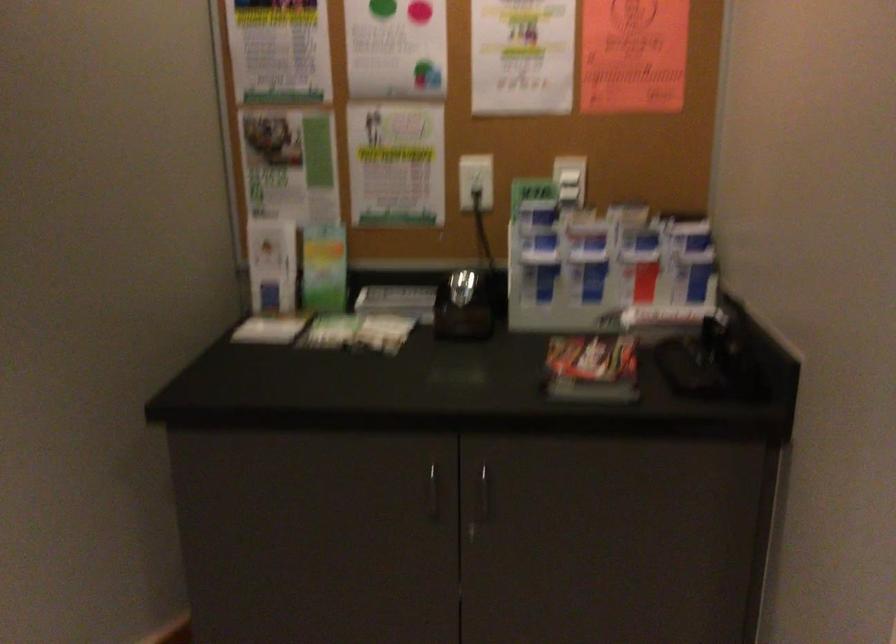
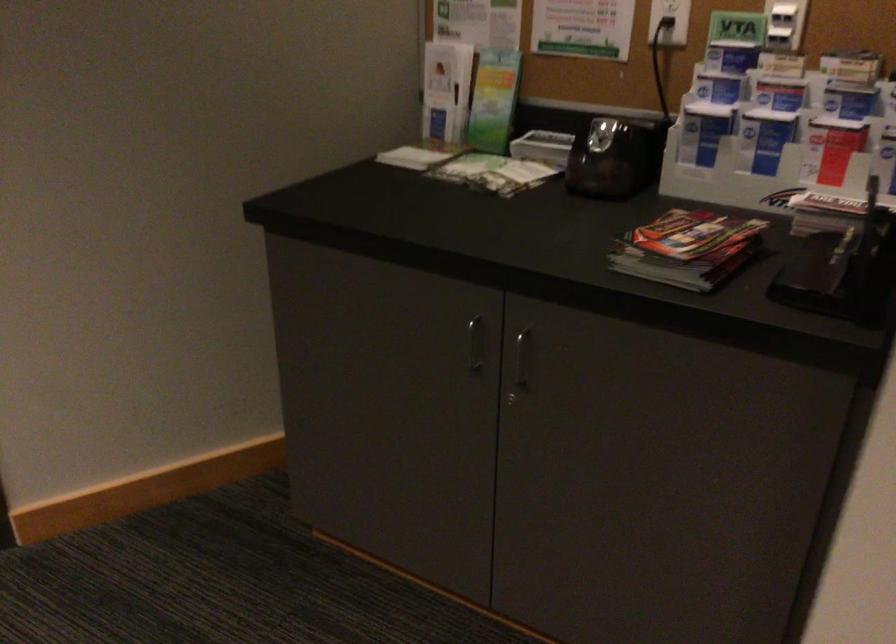
In the second image, find the point that corresponds to [474,493] in the first image.

(521, 357)